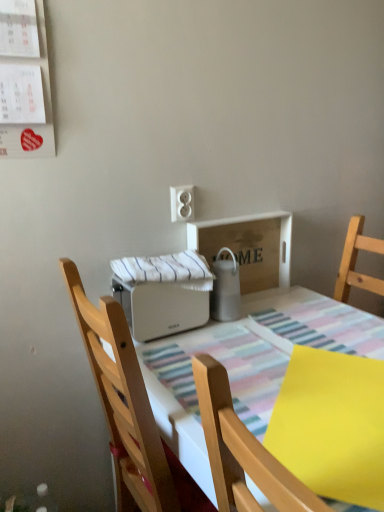
You are a GUI agent. You are given a task and a screenshot of the screen. Output one action in this format:
    pyautogui.click(x=<x>, y=<y>)
    Task: Click on the vacant space in between wooden tray at center and yellow matte paper at lower right
    This screenshot has width=384, height=512.
    Given the screenshot: What is the action you would take?
    273,340